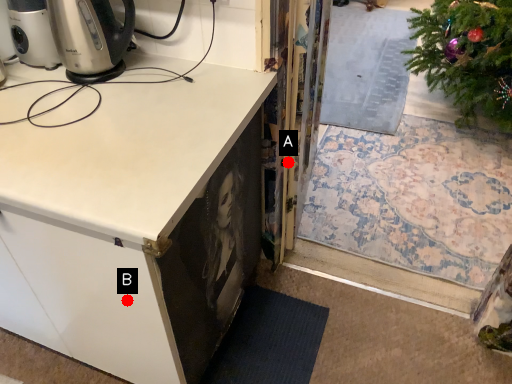
Question: Two points are circled on the image, labeled by A and B beside each circle. Which point is closer to the camera taking this photo?

Choices:
 (A) A is closer
 (B) B is closer

Answer: (B)